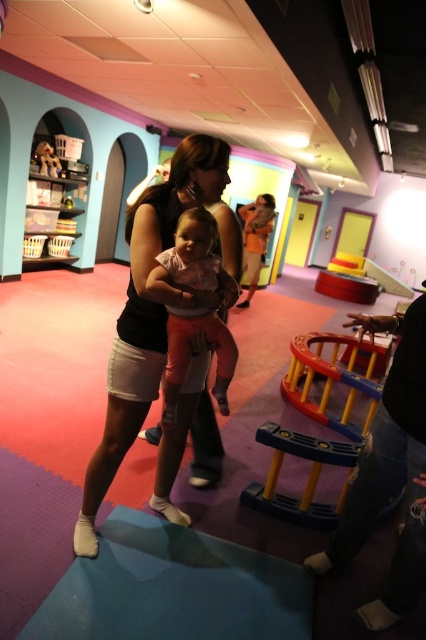
You are designing a storage box that needs to fit both the matte black tank top at center and the wooden bear at upper left. Which object requires a wider storage space?

The matte black tank top at center requires a wider storage space because it might be wider than the wooden bear at upper left.

In the scene shown: You are a clothing designer observing the indoor play area. You notice two items of clothing, the matte black tank top at center and the matte black shirt at center. Which one has a wider width?

The matte black tank top at center has a wider width than the matte black shirt at center.

You are standing at point (250,253) and want to walk towards point (230,372). Based on the scene description, will you be moving forward or backward?

Point (230,372) is in front of point (250,253), so moving towards it would mean moving forward.